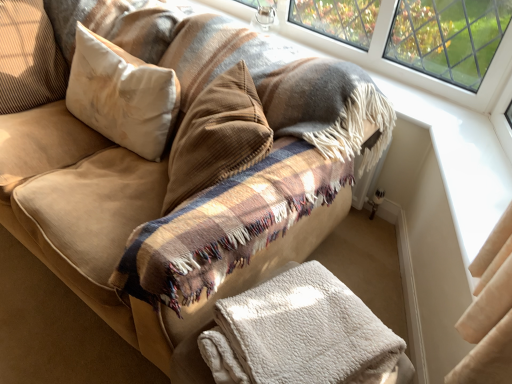
Question: Does white fluffy blanket at lower center come behind suede-like beige pillow at upper left, which ranks as the 1th pillow in left-to-right order?

Choices:
 (A) no
 (B) yes

Answer: (A)

Question: Is white fluffy blanket at lower center far away from suede-like beige pillow at upper left, which ranks as the 1th pillow in left-to-right order?

Choices:
 (A) yes
 (B) no

Answer: (A)

Question: Does white fluffy blanket at lower center turn towards suede-like beige pillow at upper left, which ranks as the 1th pillow in left-to-right order?

Choices:
 (A) no
 (B) yes

Answer: (A)

Question: Is white fluffy blanket at lower center taller than suede-like beige pillow at upper left, which ranks as the 1th pillow in left-to-right order?

Choices:
 (A) no
 (B) yes

Answer: (A)

Question: Is white fluffy blanket at lower center positioned beyond the bounds of suede-like beige pillow at upper left, which ranks as the 1th pillow in left-to-right order?

Choices:
 (A) yes
 (B) no

Answer: (A)

Question: Considering the relative positions of white soft pillow at upper left, acting as the 2th pillow starting from the left, and white fluffy blanket at lower center in the image provided, is white soft pillow at upper left, acting as the 2th pillow starting from the left, to the left or to the right of white fluffy blanket at lower center?

Choices:
 (A) left
 (B) right

Answer: (A)

Question: From their relative heights in the image, would you say white soft pillow at upper left, the first pillow positioned from the right, is taller or shorter than white fluffy blanket at lower center?

Choices:
 (A) short
 (B) tall

Answer: (B)

Question: Is point (104, 122) closer or farther from the camera than point (304, 296)?

Choices:
 (A) closer
 (B) farther

Answer: (B)

Question: Looking at the image, does white soft pillow at upper left, the first pillow positioned from the right, seem bigger or smaller compared to white fluffy blanket at lower center?

Choices:
 (A) big
 (B) small

Answer: (A)

Question: In terms of size, does suede-like beige pillow at upper left, which ranks as the 1th pillow in left-to-right order, appear bigger or smaller than white fluffy blanket at lower center?

Choices:
 (A) small
 (B) big

Answer: (B)

Question: Would you say suede-like beige pillow at upper left, marked as the second pillow in a right-to-left arrangement, is to the left or to the right of white fluffy blanket at lower center in the picture?

Choices:
 (A) right
 (B) left

Answer: (B)

Question: Considering their positions, is suede-like beige pillow at upper left, marked as the second pillow in a right-to-left arrangement, located in front of or behind white fluffy blanket at lower center?

Choices:
 (A) front
 (B) behind

Answer: (B)

Question: Is suede-like beige pillow at upper left, marked as the second pillow in a right-to-left arrangement, situated inside white fluffy blanket at lower center or outside?

Choices:
 (A) outside
 (B) inside

Answer: (A)

Question: From the image's perspective, is suede-like beige pillow at upper left, which ranks as the 1th pillow in left-to-right order, located above or below white soft pillow at upper left, the first pillow positioned from the right?

Choices:
 (A) below
 (B) above

Answer: (B)

Question: In terms of width, does suede-like beige pillow at upper left, marked as the second pillow in a right-to-left arrangement, look wider or thinner when compared to white soft pillow at upper left, the first pillow positioned from the right?

Choices:
 (A) wide
 (B) thin

Answer: (A)